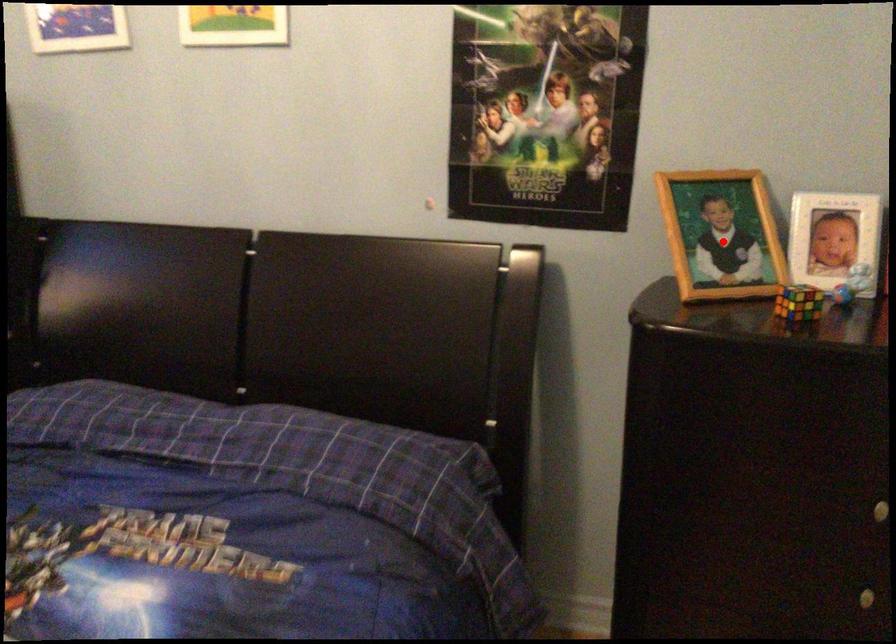
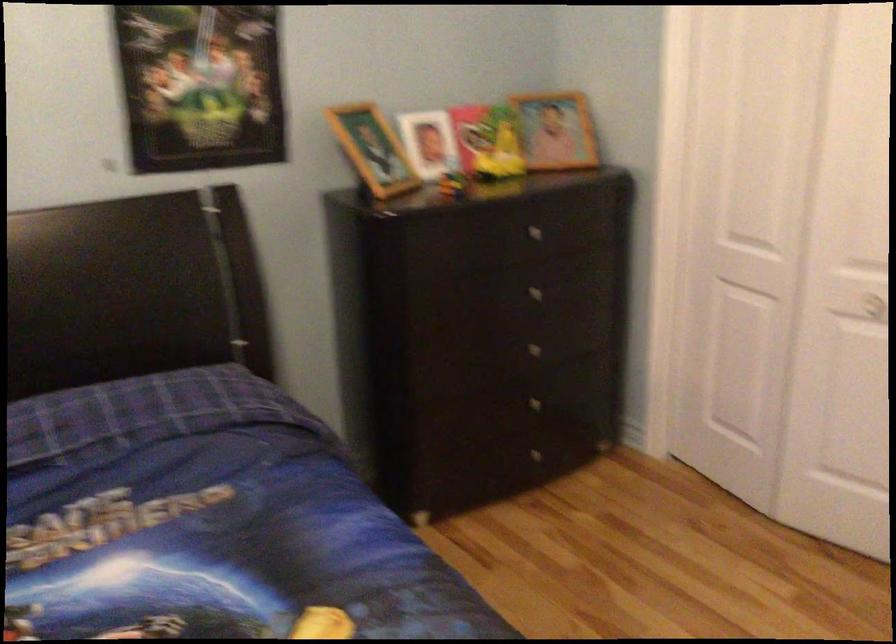
Question: I am providing you with two images of the same scene from different viewpoints. A red point is shown in image1. For the corresponding object point in image2, is it positioned nearer or farther from the camera?

Choices:
 (A) Nearer
 (B) Farther

Answer: (B)